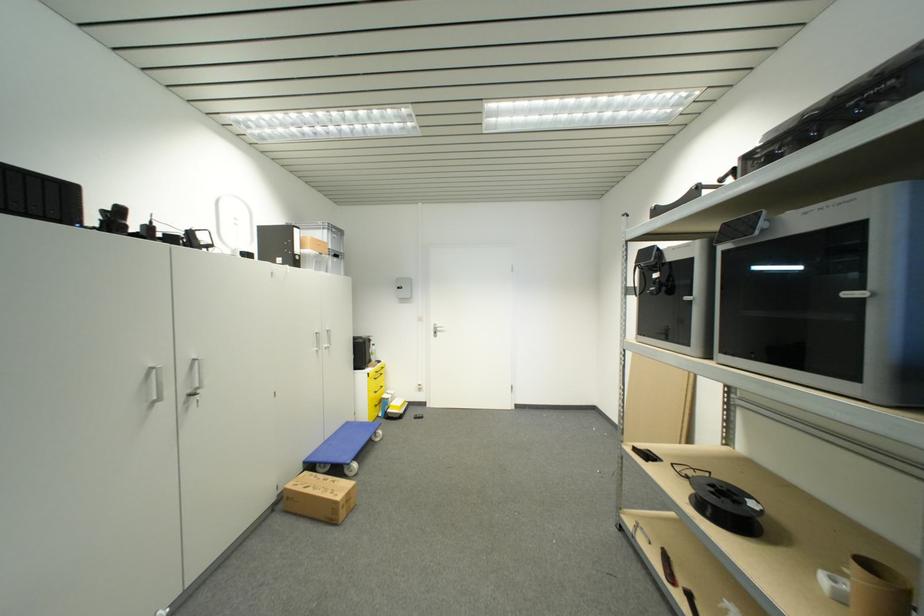
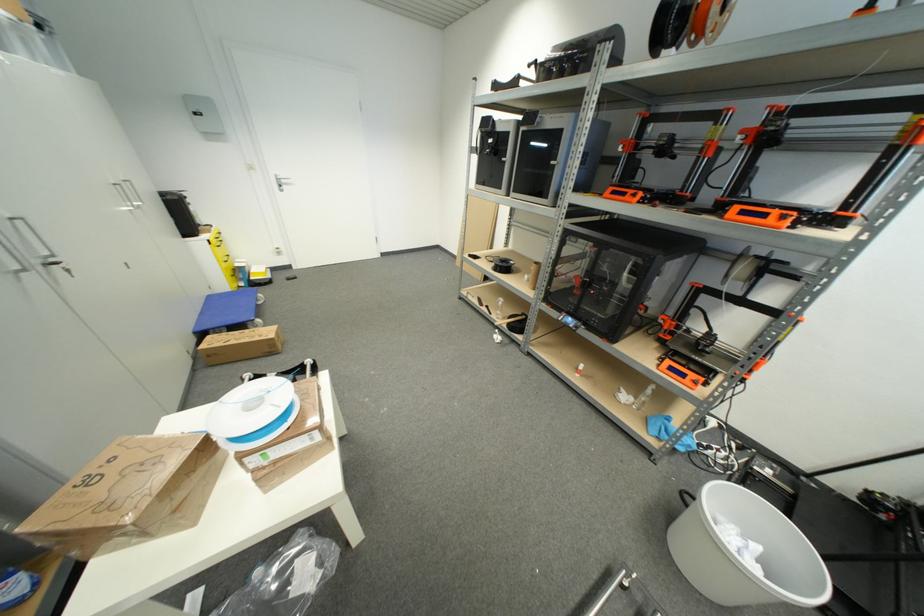
Find the pixel in the second image that matches point 198,397 in the first image.

(59, 265)